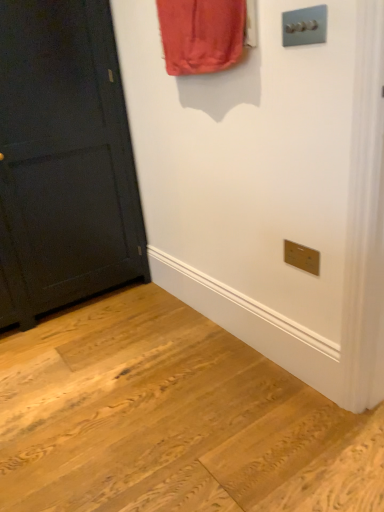
Question: In terms of width, does matte black door at left look wider or thinner when compared to satin silver light switch at upper right?

Choices:
 (A) thin
 (B) wide

Answer: (B)

Question: Is matte black door at left situated inside satin silver light switch at upper right or outside?

Choices:
 (A) outside
 (B) inside

Answer: (A)

Question: Is point (79, 115) positioned closer to the camera than point (319, 14)?

Choices:
 (A) farther
 (B) closer

Answer: (A)

Question: Is point (301, 20) positioned closer to the camera than point (94, 231)?

Choices:
 (A) closer
 (B) farther

Answer: (A)

Question: Considering the positions of satin silver light switch at upper right and matte black door at left in the image, is satin silver light switch at upper right wider or thinner than matte black door at left?

Choices:
 (A) thin
 (B) wide

Answer: (A)

Question: Based on their positions, is satin silver light switch at upper right located to the left or right of matte black door at left?

Choices:
 (A) right
 (B) left

Answer: (A)

Question: From a real-world perspective, is satin silver light switch at upper right physically located above or below matte black door at left?

Choices:
 (A) above
 (B) below

Answer: (A)